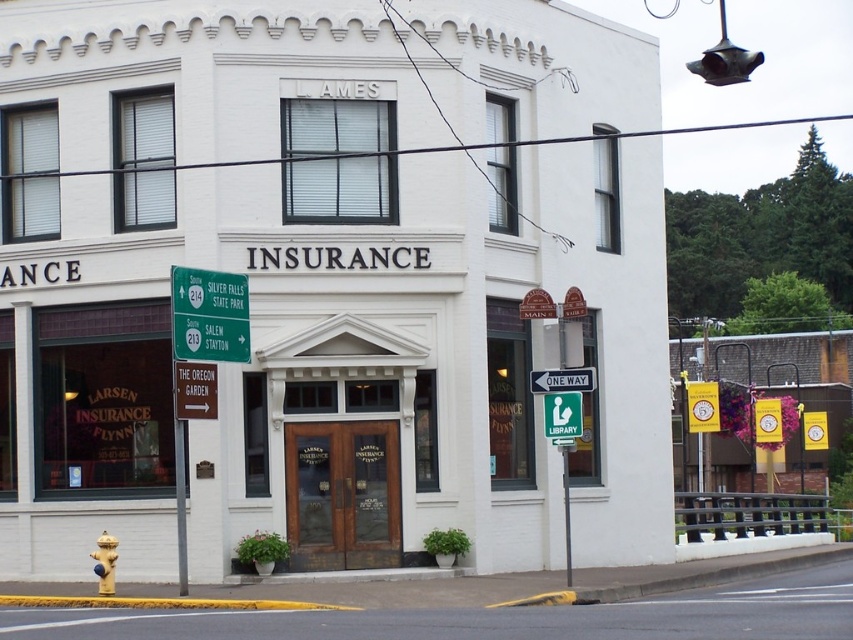
You are standing in front of the building and see the metallic pole at lower left and the yellow matte hydrant at lower left. Which one is positioned more to the left side?

The yellow matte hydrant at lower left is positioned more to the left because the metallic pole at lower left is to its right.